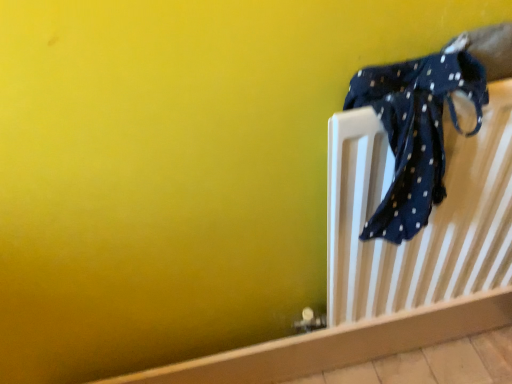
What do you see at coordinates (428, 221) in the screenshot? I see `blue dotted fabric at upper right` at bounding box center [428, 221].

In order to face blue dotted fabric at upper right, should I rotate leftwards or rightwards?

It's best to rotate right around 22.648 degrees.

Locate an element on the screen. Image resolution: width=512 pixels, height=384 pixels. blue dotted fabric at upper right is located at coordinates (428, 221).

This screenshot has height=384, width=512. Find the location of `blue dotted fabric at upper right`. blue dotted fabric at upper right is located at coordinates (428, 221).